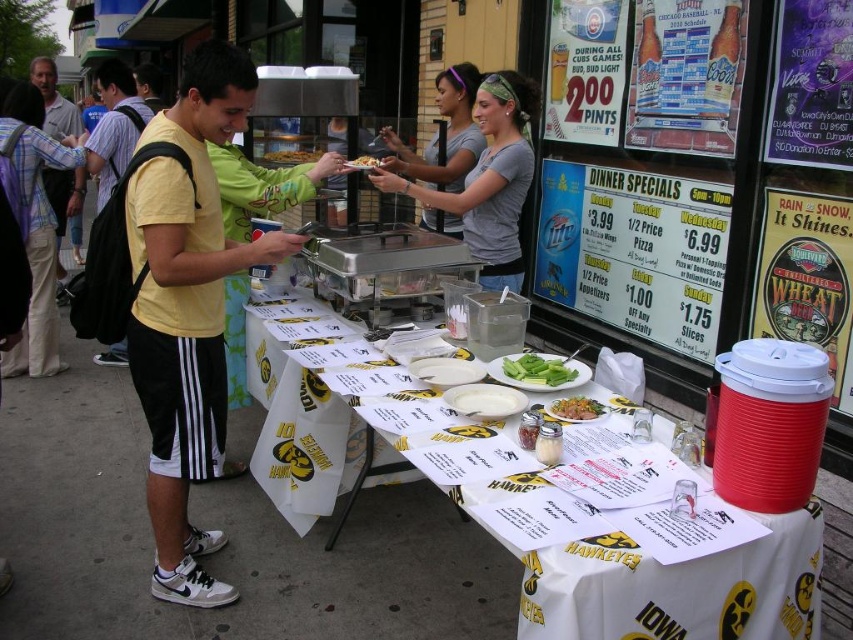
You are a customer at the Hawkeyes food stand and want to grab both the gray cotton shirt at center and the golden crispy fries at center. Which item should you reach for first if you want to pick up the one closer to your right hand?

The gray cotton shirt at center is to the right of the golden crispy fries at center, so you should reach for the gray cotton shirt at center first since it is closer to your right hand.

You are a food vendor at this event and need to place a new menu between the gray cotton shirt at center and the golden crispy fries at center. The menu is 10 inches wide. Can you fit it between them without moving either item?

The distance between the gray cotton shirt at center and the golden crispy fries at center is 20.57 inches. Since the menu is only 10 inches wide, there is enough space to place it between them without moving either item.